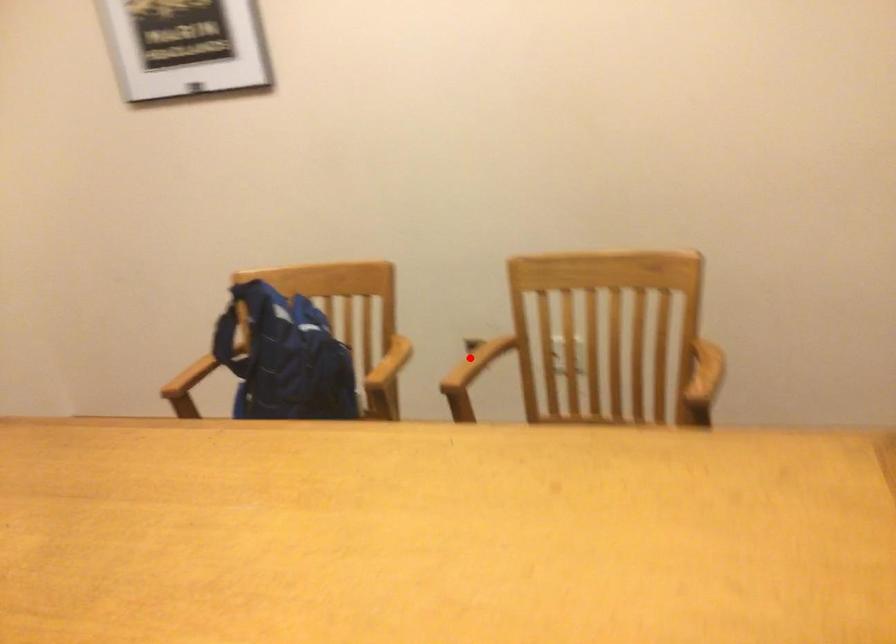
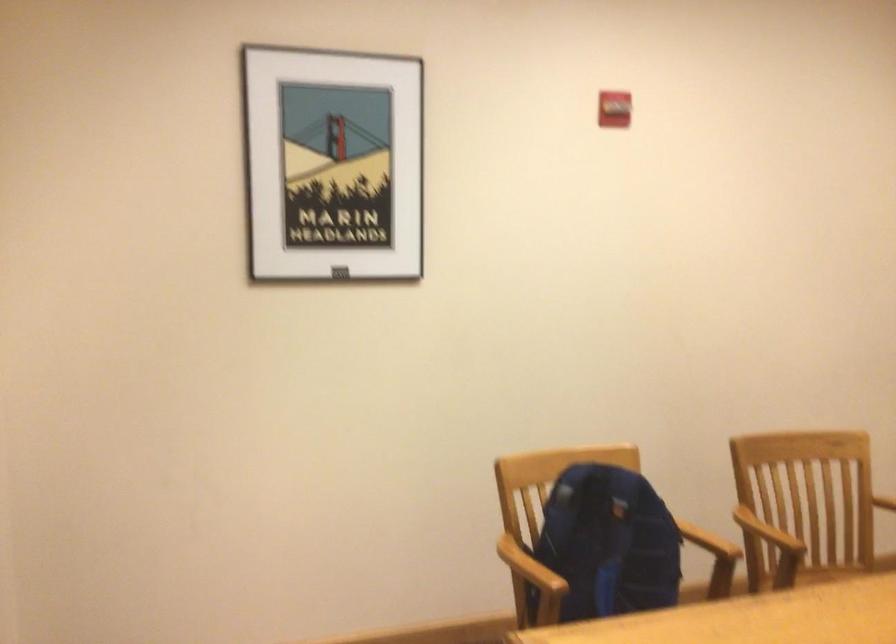
Where in the second image is the point corresponding to the highlighted location from the first image?

(767, 532)